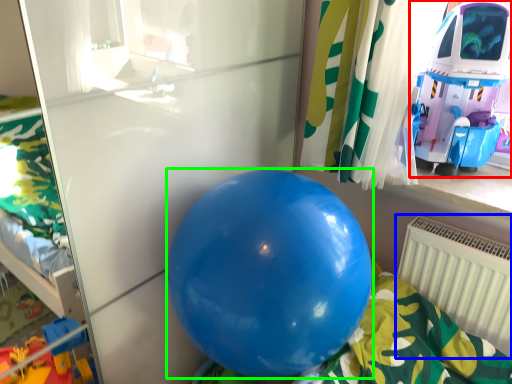
Question: Which object is positioned closest to toy (highlighted by a red box)? Select from radiator (highlighted by a blue box) and balloon (highlighted by a green box).

Choices:
 (A) radiator
 (B) balloon

Answer: (A)